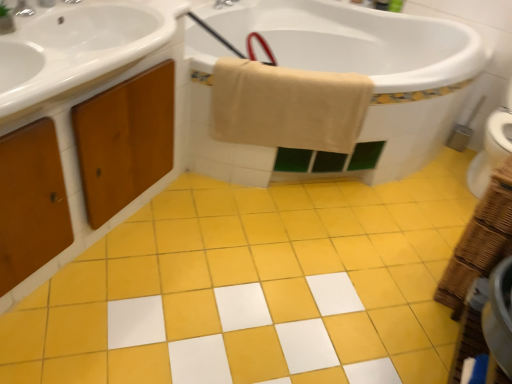
The height and width of the screenshot is (384, 512). Describe the element at coordinates (72, 1) in the screenshot. I see `brushed metal faucet at upper left` at that location.

What is the approximate width of beige cotton towel at upper center?

beige cotton towel at upper center is 10.67 inches in width.

The width and height of the screenshot is (512, 384). I want to click on metallic silver brush at right, so click(x=463, y=130).

Find the location of a particular element. This screenshot has height=384, width=512. white glossy bathtub at upper center is located at coordinates (341, 71).

In order to click on brushed metal faucet at upper left, arranged as the first tap when ordered from the bottom in this screenshot , I will do `click(23, 9)`.

The width and height of the screenshot is (512, 384). I want to click on wooden cabinet at left, so click(x=85, y=90).

Which object is positioned more to the left, brushed metal faucet at upper left, arranged as the first tap when ordered from the bottom, or white glossy bathtub at upper center?

Positioned to the left is brushed metal faucet at upper left, arranged as the first tap when ordered from the bottom.

Considering the relative positions of brushed metal faucet at upper left, placed as the 2th tap when sorted from top to bottom, and white glossy bathtub at upper center in the image provided, is brushed metal faucet at upper left, placed as the 2th tap when sorted from top to bottom, behind white glossy bathtub at upper center?

No, it is in front of white glossy bathtub at upper center.

Is brushed metal faucet at upper left, which ranks as the 2th tap in back-to-front order, not close to white glossy bathtub at upper center?

brushed metal faucet at upper left, which ranks as the 2th tap in back-to-front order, is positioned a significant distance from white glossy bathtub at upper center.

Who is taller, brushed metal faucet at upper left, which ranks as the 2th tap in right-to-left order, or white glossy bathtub at upper center?

white glossy bathtub at upper center is taller.

Which of these two, brushed metal faucet at upper center, which ranks as the second tap in left-to-right order, or white glossy bathtub at upper center, is smaller?

With smaller size is brushed metal faucet at upper center, which ranks as the second tap in left-to-right order.

From the image's perspective, is brushed metal faucet at upper center, marked as the 1th tap in a right-to-left arrangement, located beneath white glossy bathtub at upper center?

No, from the image's perspective, brushed metal faucet at upper center, marked as the 1th tap in a right-to-left arrangement, is not beneath white glossy bathtub at upper center.

Is brushed metal faucet at upper center, which is the first tap in back-to-front order, oriented towards white glossy bathtub at upper center?

Yes, brushed metal faucet at upper center, which is the first tap in back-to-front order, is facing white glossy bathtub at upper center.

From a real-world perspective, is brushed metal faucet at upper center, which is the first tap in back-to-front order, above or below white glossy bathtub at upper center?

In terms of real-world spatial position, brushed metal faucet at upper center, which is the first tap in back-to-front order, is above white glossy bathtub at upper center.

Could you tell me if wooden cabinet at left is turned towards beige cotton towel at upper center?

No, wooden cabinet at left does not turn towards beige cotton towel at upper center.

Between point (7, 69) and point (354, 84), which one is positioned behind?

The point (354, 84) is more distant.

Is beige cotton towel at upper center surrounded by wooden cabinet at left?

Actually, beige cotton towel at upper center is outside wooden cabinet at left.

Can you tell me how much white glossy bathtub at upper center and brushed metal faucet at upper left differ in facing direction?

91 degrees.

Are white glossy bathtub at upper center and brushed metal faucet at upper left beside each other?

No, white glossy bathtub at upper center is not beside brushed metal faucet at upper left.

Is white glossy bathtub at upper center not within brushed metal faucet at upper left?

Indeed, white glossy bathtub at upper center is completely outside brushed metal faucet at upper left.

Is white glossy bathtub at upper center situated inside brushed metal faucet at upper center, marked as the 1th tap in a right-to-left arrangement, or outside?

white glossy bathtub at upper center is not inside brushed metal faucet at upper center, marked as the 1th tap in a right-to-left arrangement, it's outside.

Which object is closer to the camera, white glossy bathtub at upper center or brushed metal faucet at upper center, which ranks as the second tap in left-to-right order?

white glossy bathtub at upper center is more forward.

Which is more to the left, white glossy bathtub at upper center or brushed metal faucet at upper center, placed as the 2th tap when sorted from bottom to top?

Positioned to the left is brushed metal faucet at upper center, placed as the 2th tap when sorted from bottom to top.

Could you measure the distance between white glossy bathtub at upper center and brushed metal faucet at upper center, placed as the 2th tap when sorted from bottom to top?

They are 87.93 centimeters apart.

From the image's perspective, is metallic silver brush at right under brushed metal faucet at upper left?

Yes, from the image's perspective, metallic silver brush at right is below brushed metal faucet at upper left.

Can you tell me how much metallic silver brush at right and brushed metal faucet at upper left differ in facing direction?

There is a 91.3-degree angle between the facing directions of metallic silver brush at right and brushed metal faucet at upper left.

Considering the points (469, 124) and (64, 0), which point is behind, point (469, 124) or point (64, 0)?

The point (469, 124) is farther.

Considering the sizes of metallic silver brush at right and brushed metal faucet at upper left in the image, is metallic silver brush at right taller or shorter than brushed metal faucet at upper left?

metallic silver brush at right is taller than brushed metal faucet at upper left.

In order to click on ceramic tile located on the right of wooden cabinet at left in this screenshot , I will do `click(255, 287)`.

Is yellow matte tile at center located outside wooden cabinet at left?

Yes, yellow matte tile at center is located beyond the bounds of wooden cabinet at left.

Between yellow matte tile at center and wooden cabinet at left, which one appears on the left side from the viewer's perspective?

wooden cabinet at left is more to the left.

Considering the points (243, 289) and (67, 135), which point is behind, point (243, 289) or point (67, 135)?

The point (243, 289) is farther.

Locate an element on the screen. bath lying on the right of brushed metal faucet at upper left, which ranks as the 2th tap in back-to-front order is located at coordinates (341, 71).

I want to click on tap behind the white glossy bathtub at upper center, so click(224, 3).

Consider the image. When comparing their distances from beige cotton towel at upper center, does yellow matte tile at center or brushed metal faucet at upper center, placed as the 2th tap when sorted from bottom to top, seem further?

brushed metal faucet at upper center, placed as the 2th tap when sorted from bottom to top, is positioned further to the anchor beige cotton towel at upper center.

Which object lies further to the anchor point wooden cabinet at left, white glossy bathtub at upper center or metallic silver brush at right?

metallic silver brush at right is further to wooden cabinet at left.

When comparing their distances from beige cotton towel at upper center, does brushed metal faucet at upper left or wooden cabinet at left seem closer?

wooden cabinet at left is closer to beige cotton towel at upper center.

From the image, which object appears to be nearer to wooden cabinet at left, white glossy bathtub at upper center or brushed metal faucet at upper left?

brushed metal faucet at upper left lies closer to wooden cabinet at left than the other object.

Which object lies further to the anchor point white glossy bathtub at upper center, beige cotton towel at upper center or brushed metal faucet at upper left?

Based on the image, brushed metal faucet at upper left appears to be further to white glossy bathtub at upper center.

Based on their spatial positions, is brushed metal faucet at upper left, which is counted as the first tap, starting from the front, or metallic silver brush at right closer to white glossy bathtub at upper center?

metallic silver brush at right is positioned closer to the anchor white glossy bathtub at upper center.

Looking at this image, based on their spatial positions, is beige cotton towel at upper center or wooden cabinet at left closer to metallic silver brush at right?

beige cotton towel at upper center lies closer to metallic silver brush at right than the other object.

Considering their positions, is white glossy bathtub at upper center positioned closer to beige cotton towel at upper center than metallic silver brush at right?

Among the two, white glossy bathtub at upper center is located nearer to beige cotton towel at upper center.

Where is `bath towel between brushed metal faucet at upper left and brushed metal faucet at upper center, placed as the 2th tap when sorted from bottom to top, along the z-axis`? The width and height of the screenshot is (512, 384). bath towel between brushed metal faucet at upper left and brushed metal faucet at upper center, placed as the 2th tap when sorted from bottom to top, along the z-axis is located at coordinates (287, 106).

Find the location of `bath towel between wooden cabinet at left and metallic silver brush at right from left to right`. bath towel between wooden cabinet at left and metallic silver brush at right from left to right is located at coordinates (287, 106).

In order to click on tap located between brushed metal faucet at upper left and metallic silver brush at right in the left-right direction in this screenshot , I will do `click(224, 3)`.

Locate an element on the screen. ceramic tile located between wooden cabinet at left and metallic silver brush at right in the left-right direction is located at coordinates (255, 287).